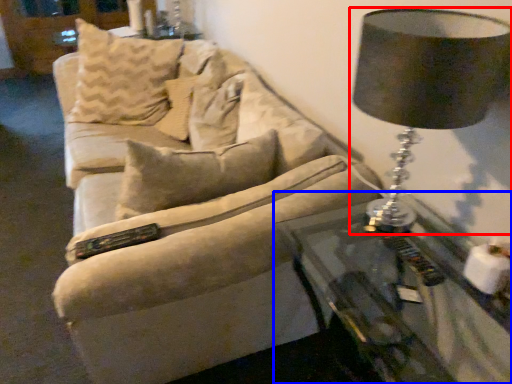
Question: Which object is further to the camera taking this photo, lamp (highlighted by a red box) or table (highlighted by a blue box)?

Choices:
 (A) lamp
 (B) table

Answer: (A)